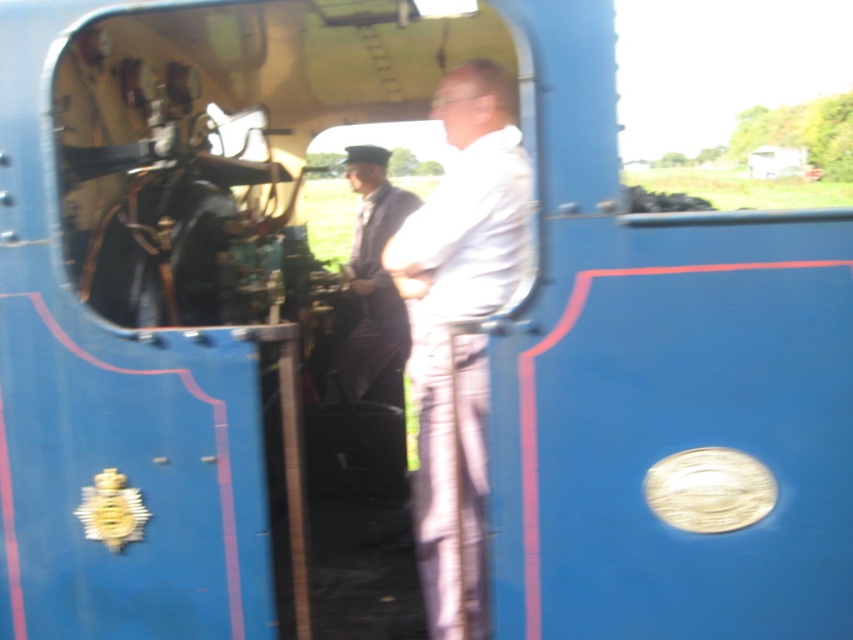
Between white matte shirt at center and dark blue uniform at center, which one appears on the left side from the viewer's perspective?

Positioned to the left is dark blue uniform at center.

This screenshot has height=640, width=853. Describe the element at coordinates (460, 320) in the screenshot. I see `white matte shirt at center` at that location.

You are a GUI agent. You are given a task and a screenshot of the screen. Output one action in this format:
    pyautogui.click(x=<x>, y=<y>)
    Task: Click on the white matte shirt at center
    Image resolution: width=853 pixels, height=640 pixels.
    Given the screenshot: What is the action you would take?
    [460, 320]